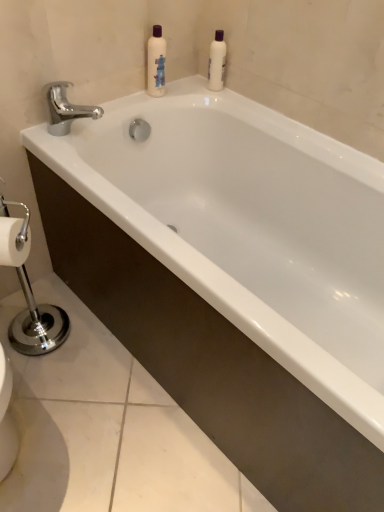
The width and height of the screenshot is (384, 512). What are the coordinates of `vacant area that is in front of chrome/metallic faucet at upper left` in the screenshot? It's located at (69, 158).